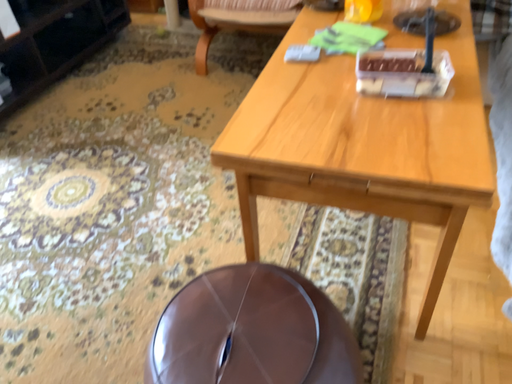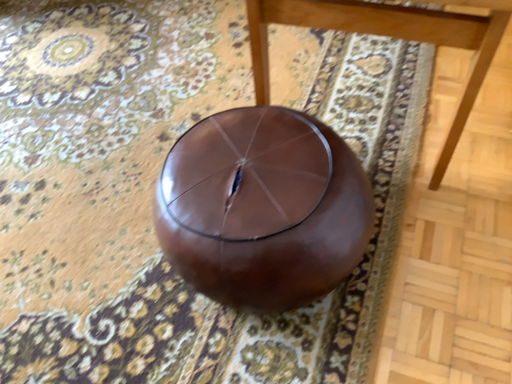
Question: Which way did the camera rotate in the video?

Choices:
 (A) rotated upward
 (B) rotated downward

Answer: (B)